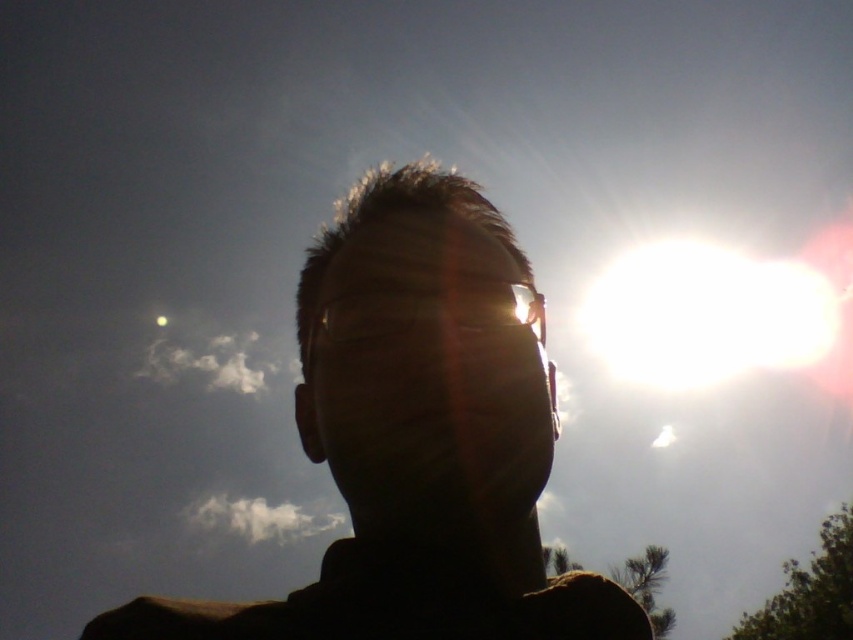
Question: Based on their relative distances, which object is farther from the silhouette face at center?

Choices:
 (A) silky skin face at center
 (B) white glossy sun at upper right

Answer: (B)

Question: Estimate the real-world distances between objects in this image. Which object is farther from the silky skin face at center?

Choices:
 (A) silhouette face at center
 (B) white glossy sun at upper right

Answer: (B)

Question: Does silhouette face at center appear over white glossy sun at upper right?

Choices:
 (A) no
 (B) yes

Answer: (A)

Question: Can you confirm if silhouette face at center is positioned to the left of silky skin face at center?

Choices:
 (A) no
 (B) yes

Answer: (B)

Question: Is silky skin face at center thinner than white glossy sun at upper right?

Choices:
 (A) yes
 (B) no

Answer: (A)

Question: Which object is the closest to the silhouette face at center?

Choices:
 (A) silky skin face at center
 (B) white glossy sun at upper right

Answer: (A)